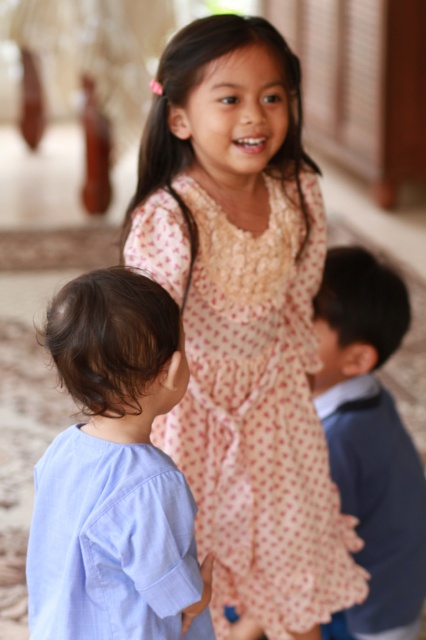
Question: Which point is closer to the camera?

Choices:
 (A) (108, 605)
 (B) (328, 566)

Answer: (A)

Question: Which of these objects is positioned farthest from the pink polka dot dress at center?

Choices:
 (A) light blue cotton shirt at lower left
 (B) blue wool sweater at right

Answer: (A)

Question: Is light blue cotton shirt at lower left to the right of blue wool sweater at right from the viewer's perspective?

Choices:
 (A) yes
 (B) no

Answer: (B)

Question: Can you confirm if pink polka dot dress at center is positioned above light blue cotton shirt at lower left?

Choices:
 (A) yes
 (B) no

Answer: (A)

Question: Does pink polka dot dress at center have a larger size compared to light blue cotton shirt at lower left?

Choices:
 (A) no
 (B) yes

Answer: (B)

Question: Which of the following is the farthest from the observer?

Choices:
 (A) (313, 189)
 (B) (391, 291)
 (C) (34, 524)

Answer: (B)